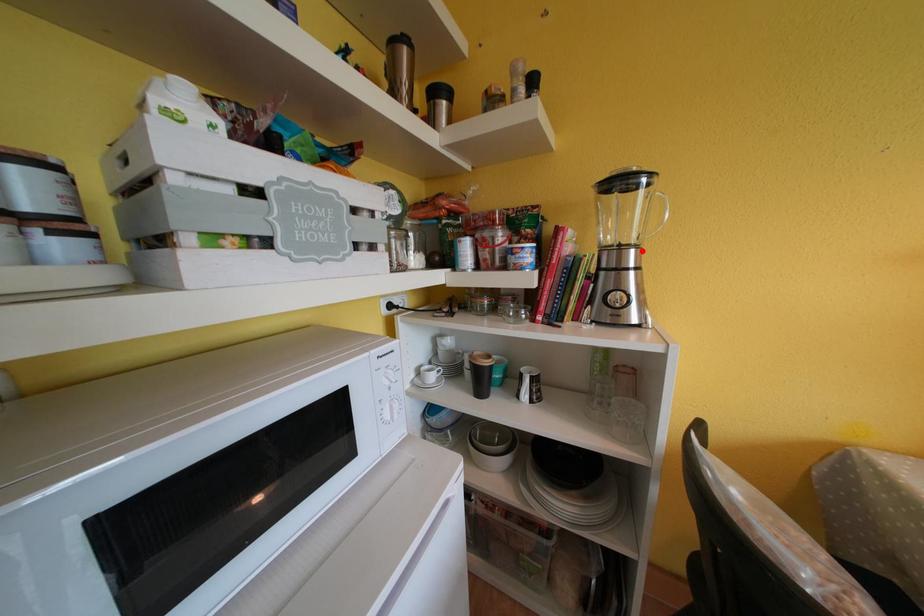
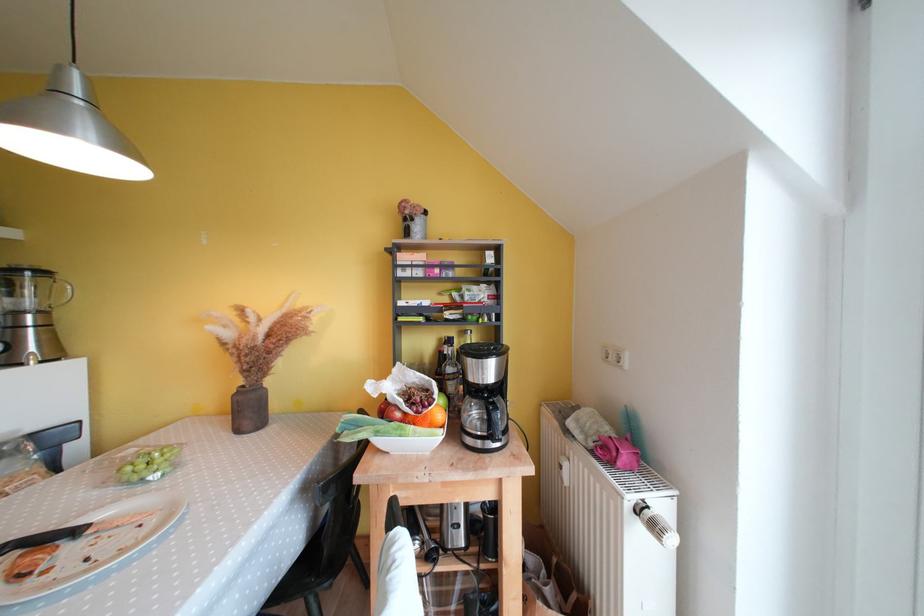
Locate, in the second image, the point that corresponds to the highlighted location in the first image.

(49, 315)